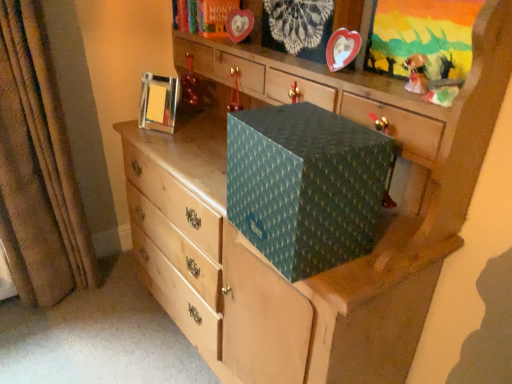
Locate an element on the screen. free space above teal textured box at center (from a real-world perspective) is located at coordinates (308, 123).